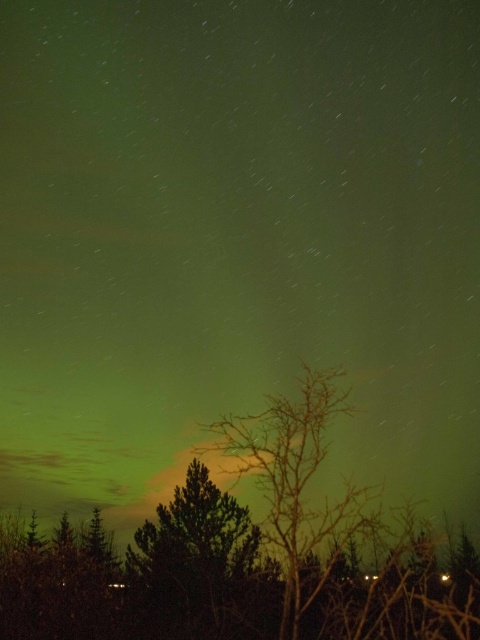
Between green leafless tree at center and green leafy tree at center, which one appears on the left side from the viewer's perspective?

Positioned to the left is green leafy tree at center.

Measure the distance between green leafless tree at center and green leafy tree at center.

green leafless tree at center and green leafy tree at center are 1.14 meters apart.

Between point (143, 563) and point (160, 538), which one is positioned in front?

Point (143, 563) is more forward.

This screenshot has width=480, height=640. What are the coordinates of `green leafless tree at center` in the screenshot? It's located at (244, 556).